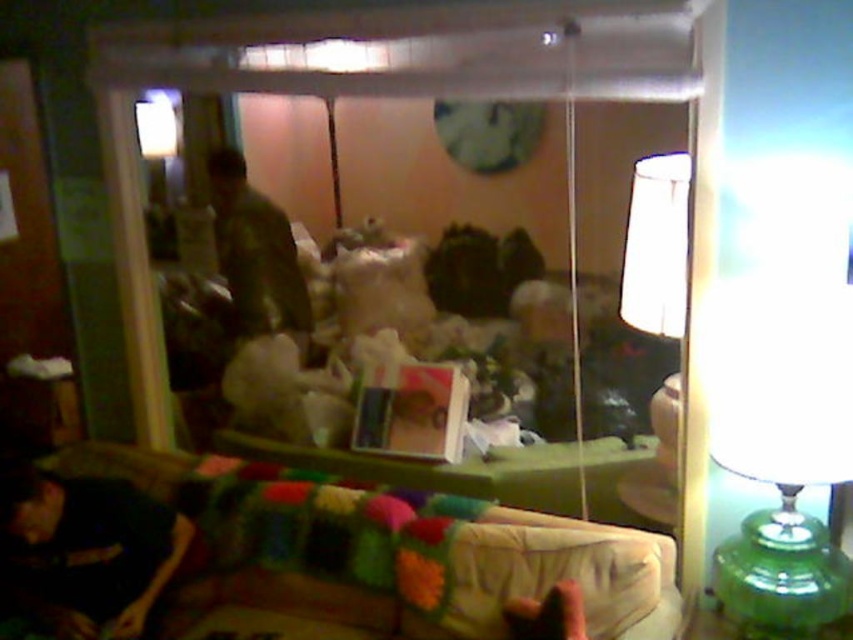
Does multicolored knitted couch at lower center appear over green glass lamp at right?

Incorrect, multicolored knitted couch at lower center is not positioned above green glass lamp at right.

Who is more distant from viewer, (x=378, y=637) or (x=724, y=372)?

The point (x=378, y=637) is behind.

Image resolution: width=853 pixels, height=640 pixels. Identify the location of multicolored knitted couch at lower center. (380, 557).

Looking at this image, does multicolored knitted couch at lower center appear under dark fabric at lower left?

Correct, multicolored knitted couch at lower center is located below dark fabric at lower left.

Is multicolored knitted couch at lower center smaller than dark fabric at lower left?

Actually, multicolored knitted couch at lower center might be larger than dark fabric at lower left.

Between point (604, 616) and point (12, 531), which one is positioned behind?

Point (12, 531)

This screenshot has width=853, height=640. What are the coordinates of `multicolored knitted couch at lower center` in the screenshot? It's located at coord(380,557).

Can you confirm if green glass lamp at right is smaller than dark fabric at lower left?

No, green glass lamp at right is not smaller than dark fabric at lower left.

Who is higher up, green glass lamp at right or dark fabric at lower left?

green glass lamp at right is above.

Find the location of a particular element. green glass lamp at right is located at coordinates (782, 451).